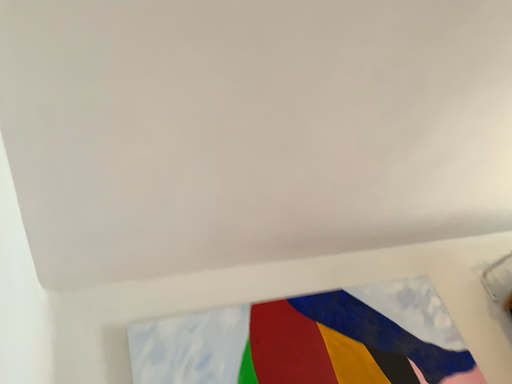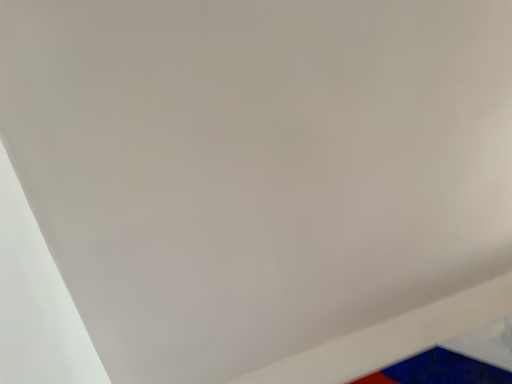
Question: Which way did the camera rotate in the video?

Choices:
 (A) rotated downward
 (B) rotated upward

Answer: (B)